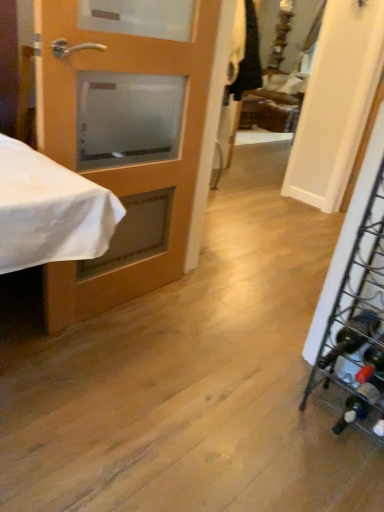
This screenshot has height=512, width=384. What do you see at coordinates (125, 136) in the screenshot?
I see `matte wood door at left` at bounding box center [125, 136].

Where is `matte wood door at left`? The width and height of the screenshot is (384, 512). matte wood door at left is located at coordinates (125, 136).

The width and height of the screenshot is (384, 512). What do you see at coordinates (357, 328) in the screenshot?
I see `metallic wire wine rack at right` at bounding box center [357, 328].

The image size is (384, 512). Find the location of `metallic wire wine rack at right`. metallic wire wine rack at right is located at coordinates (357, 328).

Image resolution: width=384 pixels, height=512 pixels. What are the coordinates of `matte wood door at left` in the screenshot? It's located at (125, 136).

Does matte wood door at left appear on the left side of metallic wire wine rack at right?

Correct, you'll find matte wood door at left to the left of metallic wire wine rack at right.

Considering the relative positions of matte wood door at left and metallic wire wine rack at right in the image provided, is matte wood door at left behind metallic wire wine rack at right?

Yes, matte wood door at left is further from the camera.

Considering the points (75, 168) and (370, 223), which point is behind, point (75, 168) or point (370, 223)?

The point (75, 168) is farther from the camera.

From the image's perspective, which one is positioned higher, matte wood door at left or metallic wire wine rack at right?

matte wood door at left appears higher in the image.

From a real-world perspective, is matte wood door at left above or below metallic wire wine rack at right?

matte wood door at left is situated higher than metallic wire wine rack at right in the real world.

Can you confirm if matte wood door at left is thinner than metallic wire wine rack at right?

Indeed, matte wood door at left has a lesser width compared to metallic wire wine rack at right.

Considering the sizes of objects matte wood door at left and metallic wire wine rack at right in the image provided, who is shorter, matte wood door at left or metallic wire wine rack at right?

metallic wire wine rack at right.

Considering the sizes of objects matte wood door at left and metallic wire wine rack at right in the image provided, who is smaller, matte wood door at left or metallic wire wine rack at right?

With smaller size is metallic wire wine rack at right.

Is metallic wire wine rack at right completely or partially inside matte wood door at left?

That's incorrect, metallic wire wine rack at right is not inside matte wood door at left.

Are matte wood door at left and metallic wire wine rack at right located far from each other?

No, matte wood door at left is not far away from metallic wire wine rack at right.

Is matte wood door at left looking in the opposite direction of metallic wire wine rack at right?

No, matte wood door at left's orientation is not away from metallic wire wine rack at right.

How many degrees apart are the facing directions of matte wood door at left and metallic wire wine rack at right?

The angular difference between matte wood door at left and metallic wire wine rack at right is 95.3 degrees.

How far apart are matte wood door at left and metallic wire wine rack at right?

matte wood door at left and metallic wire wine rack at right are 36.27 inches apart.

You are a GUI agent. You are given a task and a screenshot of the screen. Output one action in this format:
    pyautogui.click(x=<x>, y=<y>)
    Task: Click on the door behind the metallic wire wine rack at right
    
    Given the screenshot: What is the action you would take?
    pyautogui.click(x=125, y=136)

Can you confirm if metallic wire wine rack at right is positioned to the right of matte wood door at left?

Yes, metallic wire wine rack at right is to the right of matte wood door at left.

From the picture: Does metallic wire wine rack at right come behind matte wood door at left?

No, metallic wire wine rack at right is in front of matte wood door at left.

Which is closer, (376,280) or (89,287)?

Point (376,280) is positioned closer to the camera compared to point (89,287).

From the image's perspective, is metallic wire wine rack at right located above matte wood door at left?

No, from the image's perspective, metallic wire wine rack at right is not on top of matte wood door at left.

From a real-world perspective, which object stands above the other?

matte wood door at left is physically above.

Which object is thinner, metallic wire wine rack at right or matte wood door at left?

With smaller width is matte wood door at left.

From their relative heights in the image, would you say metallic wire wine rack at right is taller or shorter than matte wood door at left?

metallic wire wine rack at right is shorter than matte wood door at left.

From the picture: Who is bigger, metallic wire wine rack at right or matte wood door at left?

Bigger between the two is matte wood door at left.

Is metallic wire wine rack at right situated inside matte wood door at left or outside?

metallic wire wine rack at right is spatially situated outside matte wood door at left.

Is metallic wire wine rack at right far from matte wood door at left?

metallic wire wine rack at right is actually quite close to matte wood door at left.

Could you tell me if metallic wire wine rack at right is turned towards matte wood door at left?

No, metallic wire wine rack at right is not facing towards matte wood door at left.

The image size is (384, 512). What are the coordinates of `door on the left of metallic wire wine rack at right` in the screenshot? It's located at (125, 136).

The width and height of the screenshot is (384, 512). I want to click on door above the metallic wire wine rack at right (from a real-world perspective), so click(125, 136).

Where is `door on the left of metallic wire wine rack at right`? door on the left of metallic wire wine rack at right is located at coordinates (125, 136).